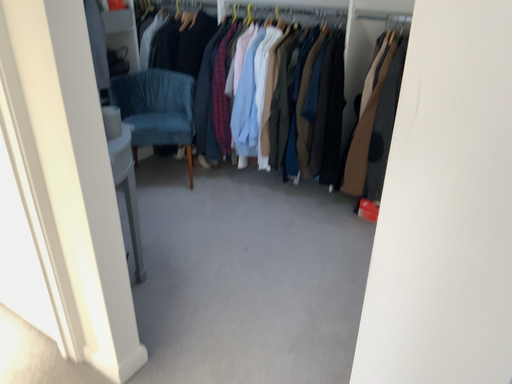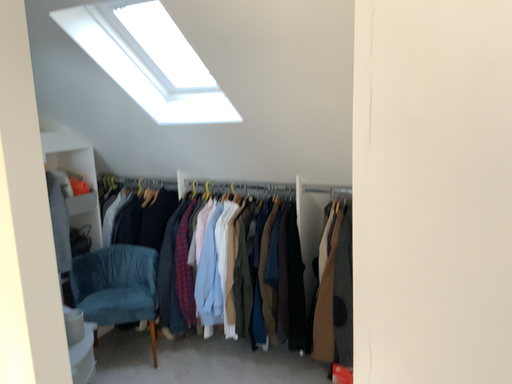
Question: How did the camera likely rotate when shooting the video?

Choices:
 (A) rotated downward
 (B) rotated upward

Answer: (B)